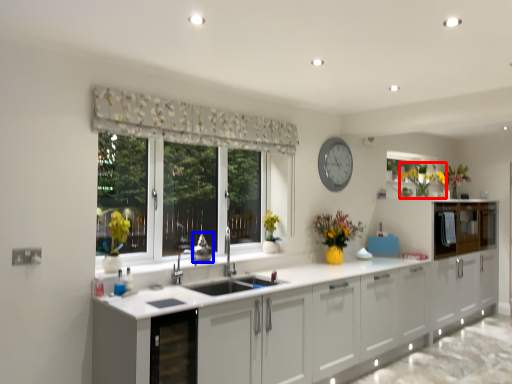
Question: Which object appears closest to the camera in this image, floral arrangement (highlighted by a red box) or appliance (highlighted by a blue box)?

Choices:
 (A) floral arrangement
 (B) appliance

Answer: (B)